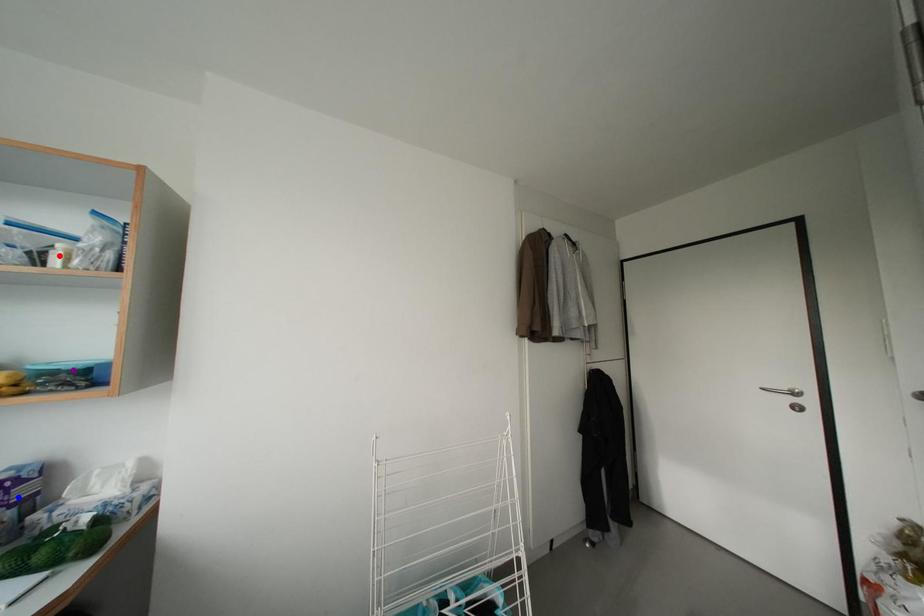
Order these from nearest to farthest:
blue point
red point
purple point

red point, purple point, blue point